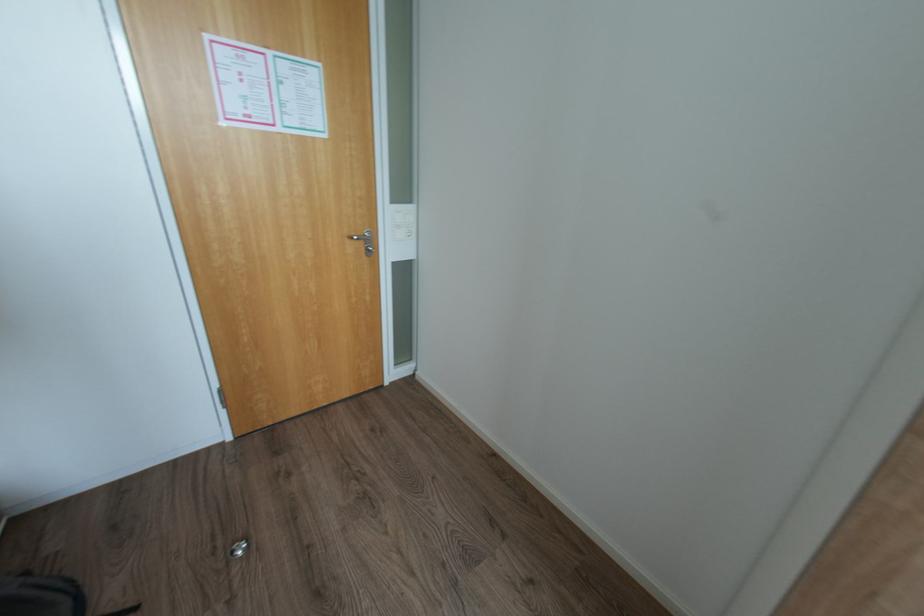
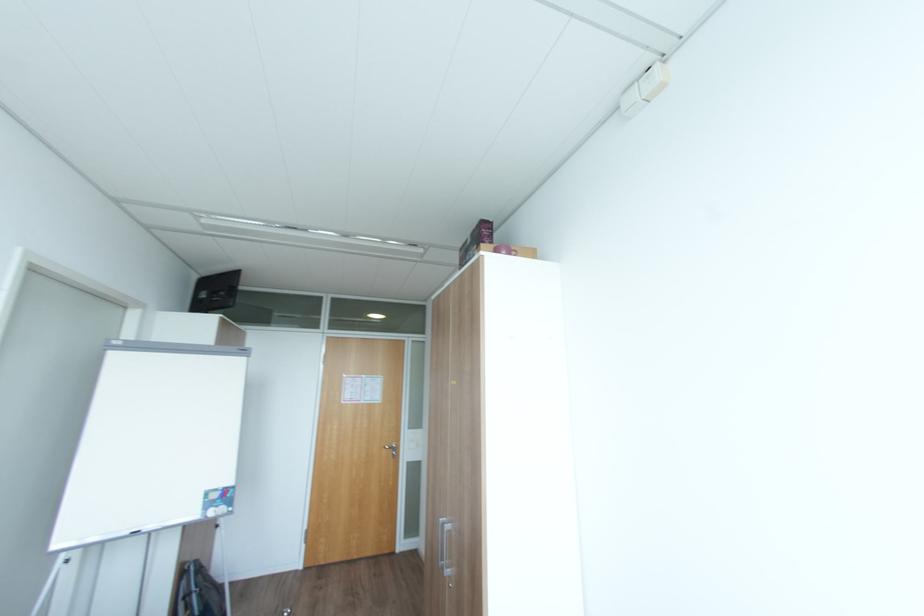
Locate, in the second image, the point that corresponds to pixel 360 237 in the first image.

(392, 448)